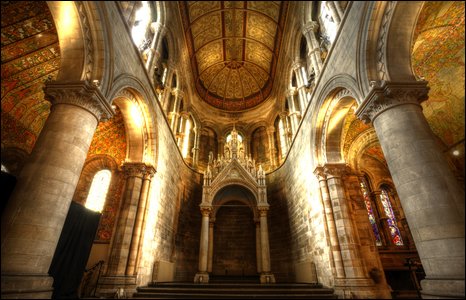
Locate an element on the screen. glass windows is located at coordinates (329, 26), (143, 33), (160, 84), (190, 150), (279, 136), (296, 94).